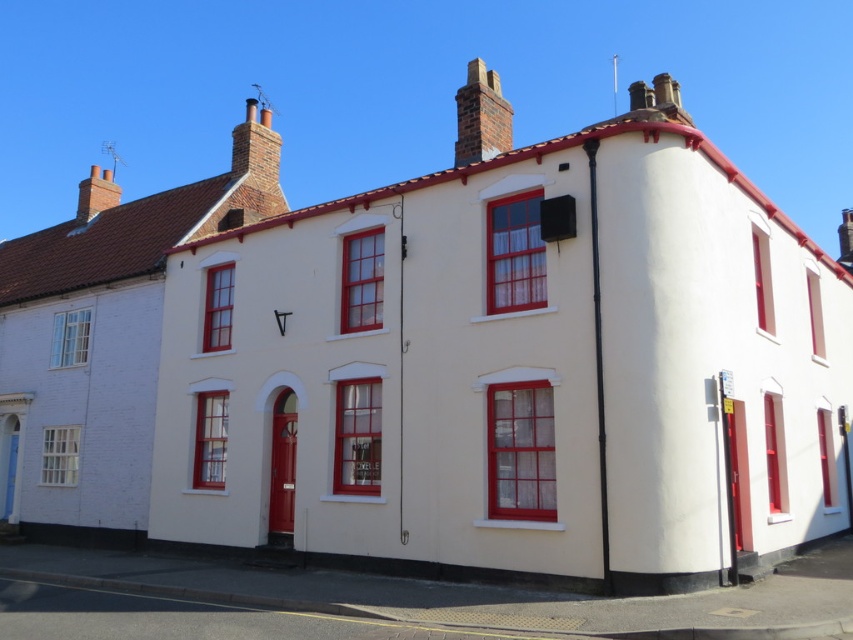
Is point (177, 284) in front of point (474, 148)?

No, it is not.

Does white painted wood trim at center have a greater width compared to brick chimney at upper center?

Indeed, white painted wood trim at center has a greater width compared to brick chimney at upper center.

Measure the distance between white painted wood trim at center and camera.

11.01 meters

Identify the location of white painted wood trim at center. (515, 369).